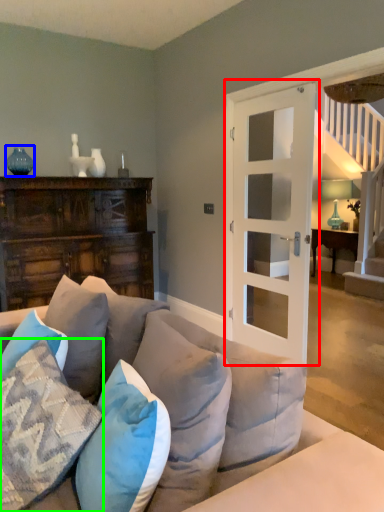
Question: Estimate the real-world distances between objects in this image. Which object is farther from door (highlighted by a red box), teal (highlighted by a blue box) or pillow (highlighted by a green box)?

Choices:
 (A) teal
 (B) pillow

Answer: (A)